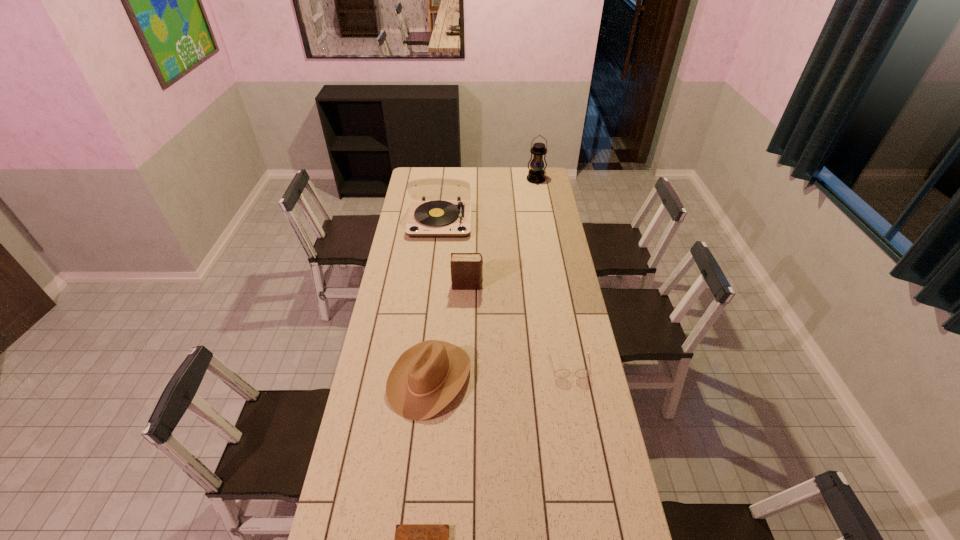
You are a GUI agent. You are given a task and a screenshot of the screen. Output one action in this format:
    pyautogui.click(x=<x>, y=<y>)
    Task: Click on the vacant space located on the temples of the spectacles
    The width and height of the screenshot is (960, 540).
    Given the screenshot: What is the action you would take?
    point(582,433)

Find the location of a particular element. The height and width of the screenshot is (540, 960). object at the far edge is located at coordinates (536, 175).

Find the location of a particular element. The width and height of the screenshot is (960, 540). record player that is at the left edge is located at coordinates (427, 219).

Find the location of a particular element. cowboy hat that is positioned at the left edge is located at coordinates (426, 377).

Identify the location of lantern positioned at the right edge. The width and height of the screenshot is (960, 540). (536, 175).

This screenshot has height=540, width=960. Identify the location of spectacles that is positioned at the right edge. (561, 373).

The height and width of the screenshot is (540, 960). In order to click on object positioned at the far right corner in this screenshot , I will do `click(536, 175)`.

In the image, there is a desktop. At what (x,y) coordinates should I click in order to perform the action: click on vacant region at the left edge. Please return your answer as a coordinate pair (x, y). The height and width of the screenshot is (540, 960). Looking at the image, I should click on pos(400,218).

The image size is (960, 540). Identify the location of blank space at the right edge. (631, 530).

Where is `vacant point at the far left corner`? vacant point at the far left corner is located at coordinates (423, 173).